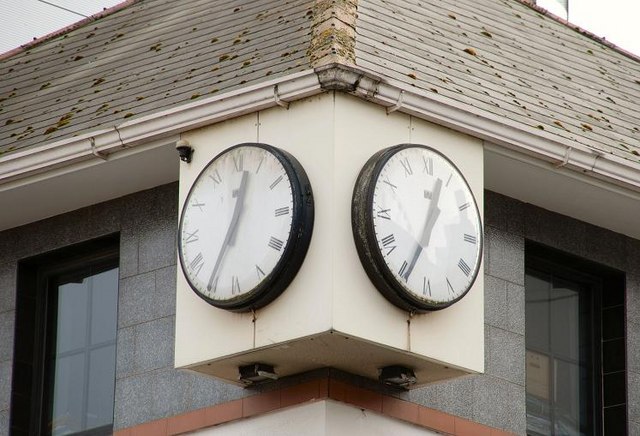
Locate an element on the screen. Image resolution: width=640 pixels, height=436 pixels. 2 clocks is located at coordinates (432, 224), (248, 214).